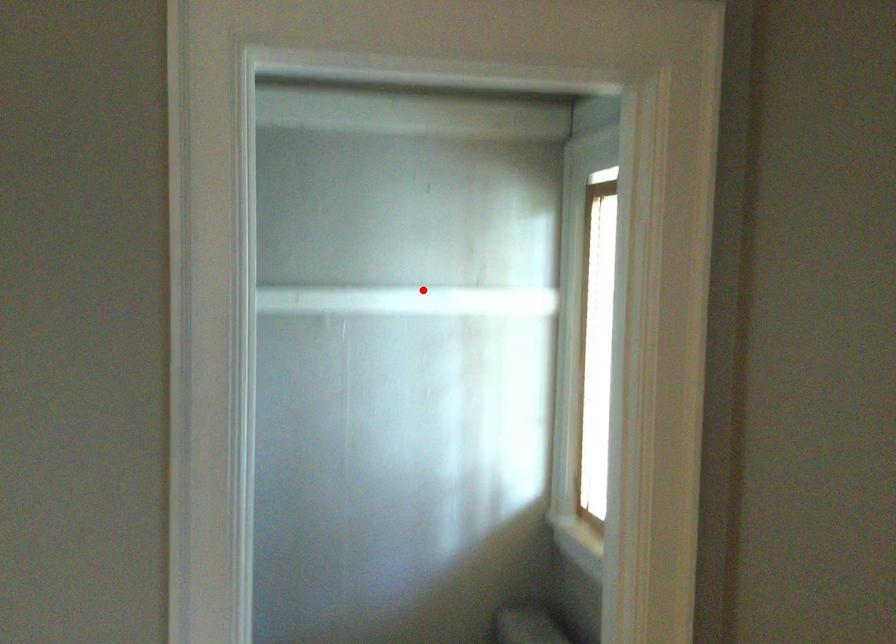
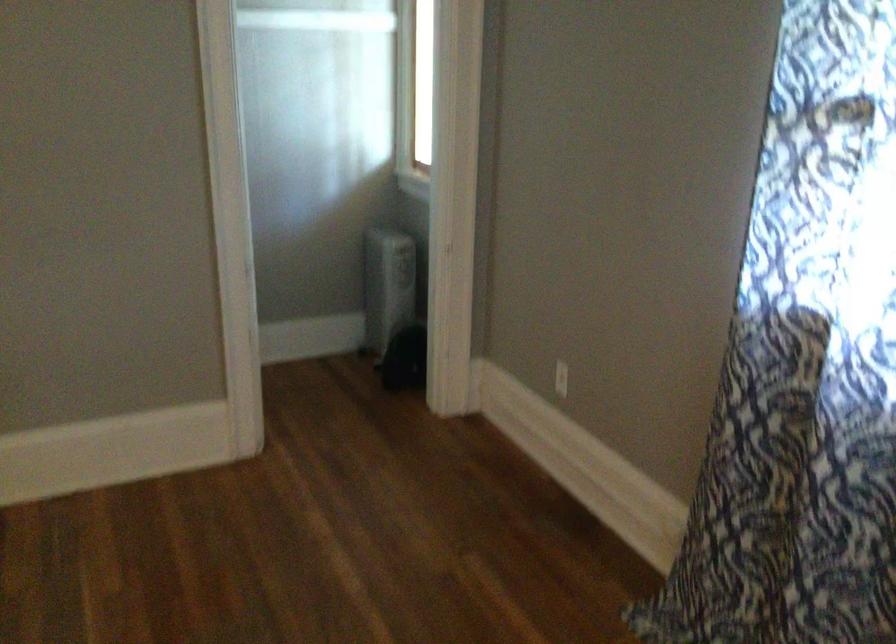
Question: I am providing you with two images of the same scene from different viewpoints. Image1 has a red point marked. In image2, the corresponding 3D location appears at what relative position? Reply with the corresponding letter.

Choices:
 (A) Closer
 (B) Farther

Answer: (B)